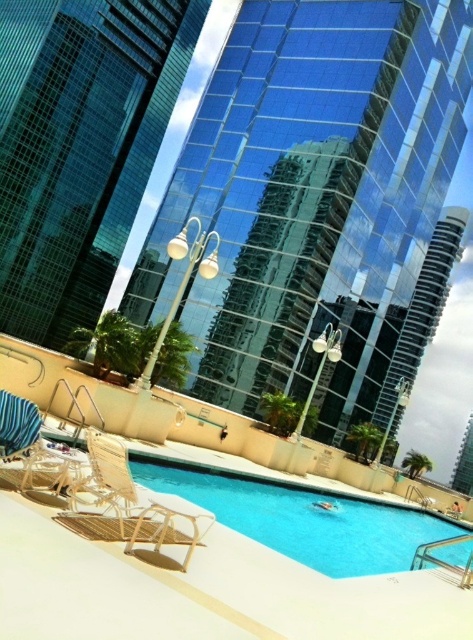
Who is higher up, transparent glass building at center or blue glossy water at center?

transparent glass building at center is above.

I want to click on transparent glass building at center, so click(x=311, y=168).

Where is `transparent glass building at center`? transparent glass building at center is located at coordinates (311, 168).

Which of these two, blue glossy water at center or beige woven beach chair at lower left, stands shorter?

beige woven beach chair at lower left

Which is in front, point (286, 540) or point (64, 464)?

Point (64, 464) is in front.

Where is `blue glossy water at center`? blue glossy water at center is located at coordinates (301, 516).

Can you confirm if transparent glass building at center is positioned below beige woven beach chair at lower left?

Actually, transparent glass building at center is above beige woven beach chair at lower left.

Is point (265, 323) farther from camera compared to point (18, 456)?

Yes, it is.

Does point (116, 284) come closer to viewer compared to point (58, 460)?

No, it is not.

Find the location of `transparent glass building at center`. transparent glass building at center is located at coordinates coord(311,168).